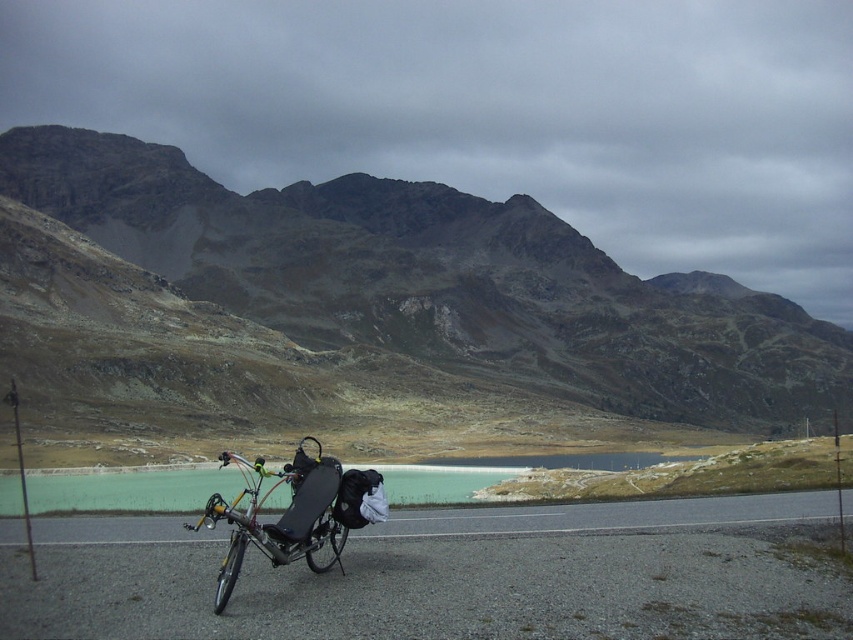
You are a hiker planning to hike from the rugged stone mountain at upper center to the green glassy water at center. The trail is straight and follows the shortest path between them. Your GPS says the distance is 154.52 meters. Is this accurate based on the image?

The rugged stone mountain at upper center and green glassy water at center are 154.52 meters apart, so the GPS reading is accurate.

You are standing on the paved road and want to reach the green glassy water at center. Which direction should you walk to get there?

The green glassy water at center is located at coordinate point (131, 490), so you should walk towards the center of the image to reach it.